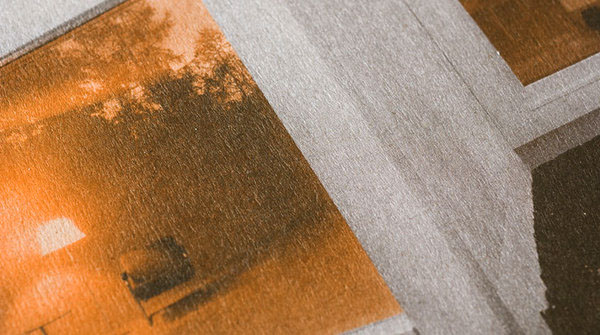
Locate an element on the screen. table is located at coordinates (47, 317).